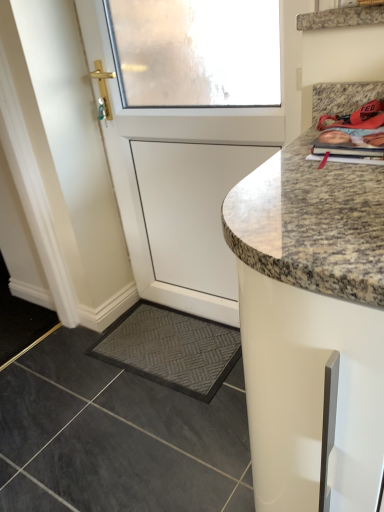
This screenshot has height=512, width=384. What are the coordinates of `vacant area that is in front of white matte door at upper left` in the screenshot? It's located at (166, 436).